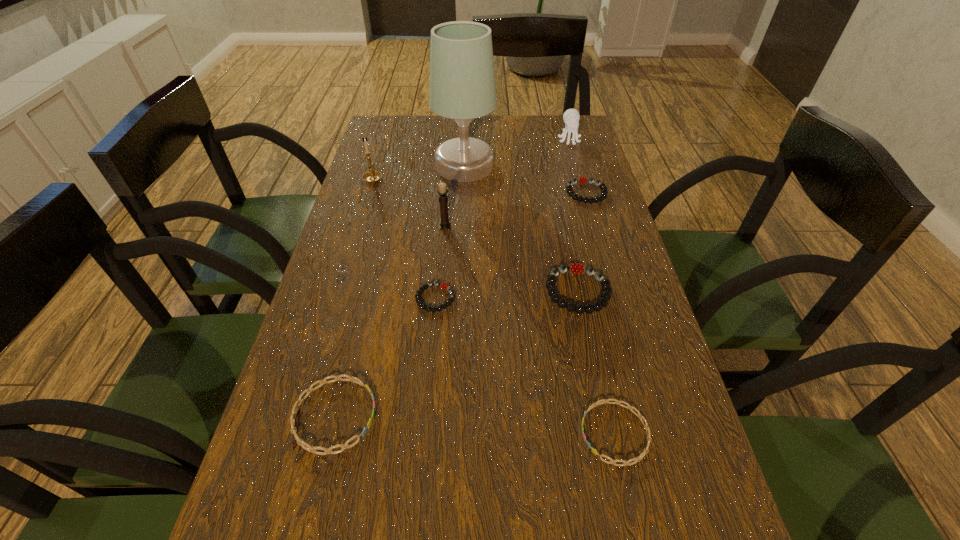
The image size is (960, 540). Identify the location of vacant space situated 0.320m on the handle side of the gold candle holder. (390, 122).

Find the location of a particular element. This screenshot has width=960, height=540. vacant space located on the front of the right candle holder is located at coordinates (435, 338).

Where is `free region located on the front-facing side of the octopus`? This screenshot has height=540, width=960. free region located on the front-facing side of the octopus is located at coordinates (584, 192).

Find the location of a particular element. The height and width of the screenshot is (540, 960). free location located on the back of the fifth shortest object is located at coordinates (564, 224).

Find the location of `vacant region located 0.070m on the surface of the leftmost bracelet showing star-shaped elements`. vacant region located 0.070m on the surface of the leftmost bracelet showing star-shaped elements is located at coordinates (415, 415).

You are a GUI agent. You are given a task and a screenshot of the screen. Output one action in this format:
    pyautogui.click(x=<x>, y=<y>)
    Task: Click on the free location located on the back of the farthest bracelet
    The height and width of the screenshot is (540, 960).
    Given the screenshot: What is the action you would take?
    [x=579, y=166]

The width and height of the screenshot is (960, 540). What are the coordinates of `free space located on the surface of the smaller blue bracelet showing star-shaped elements` in the screenshot? It's located at (405, 433).

Identify the location of vacant space located on the surface of the smaller blue bracelet showing star-shaped elements. (416, 433).

The image size is (960, 540). I want to click on free space located 0.270m on the surface of the smaller blue bracelet showing star-shaped elements, so click(x=427, y=433).

The height and width of the screenshot is (540, 960). Identify the location of free space located on the right of the smallest black bracelet. (531, 298).